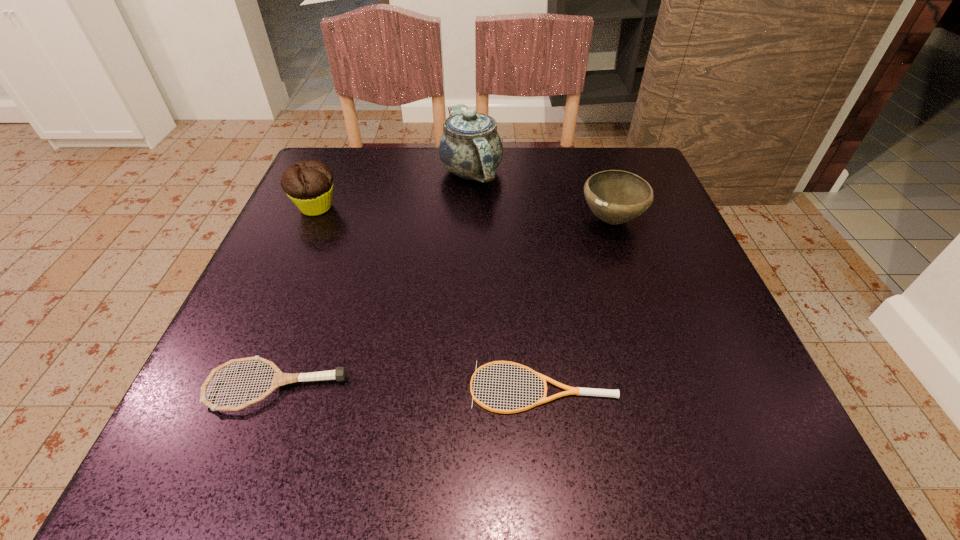
The image size is (960, 540). Find the location of `object situated at the near left corner`. object situated at the near left corner is located at coordinates (279, 379).

What are the coordinates of `object located at the far right corner` in the screenshot? It's located at (615, 196).

In the image, there is a desktop. At what (x,y) coordinates should I click in order to perform the action: click on free space at the far edge. Please return your answer as a coordinate pair (x, y). Looking at the image, I should click on (517, 150).

At what (x,y) coordinates should I click in order to perform the action: click on vacant space at the near edge of the desktop. Please return your answer as a coordinate pair (x, y). This screenshot has width=960, height=540. Looking at the image, I should click on (442, 455).

You are a GUI agent. You are given a task and a screenshot of the screen. Output one action in this format:
    pyautogui.click(x=<x>, y=<y>)
    Task: Click on the free space at the right edge of the desktop
    
    Given the screenshot: What is the action you would take?
    pyautogui.click(x=685, y=238)

Locate an element on the screen. The height and width of the screenshot is (540, 960). free location at the far left corner of the desktop is located at coordinates (343, 202).

This screenshot has width=960, height=540. Identify the location of vacant space at the near left corner of the desktop. (269, 469).

In the image, there is a desktop. Identify the location of vacant space at the far right corner. (659, 202).

Where is `vacant region at the near right corner of the desktop`? vacant region at the near right corner of the desktop is located at coordinates click(764, 437).

What are the coordinates of `unoccupied position between the third shortest object and the second shortest object` in the screenshot? It's located at (444, 303).